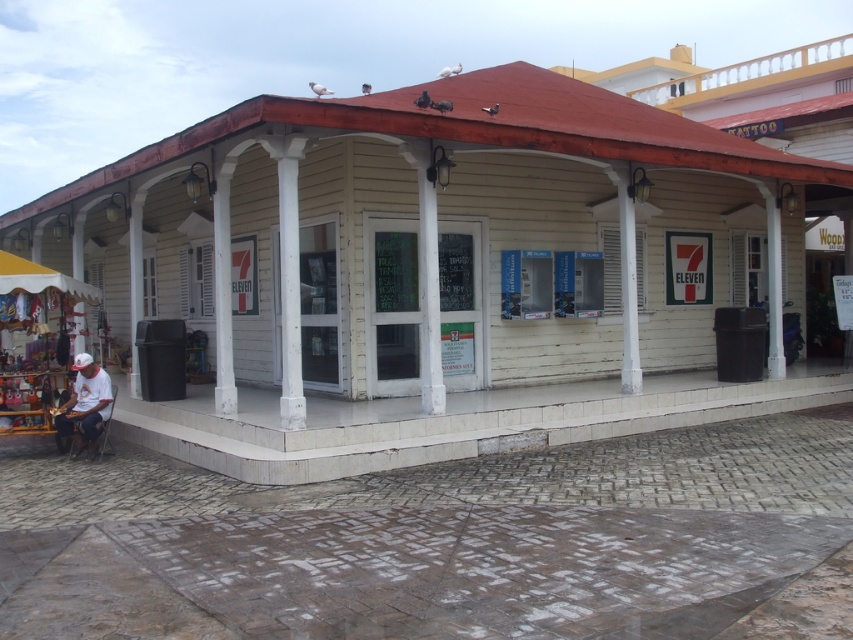
Question: Does white matte shirt at lower left come behind yellow fabric canopy at lower left?

Choices:
 (A) no
 (B) yes

Answer: (A)

Question: Which point is farther to the camera?

Choices:
 (A) (730, 177)
 (B) (93, 408)

Answer: (A)

Question: Does white wood 7-eleven at center appear on the left side of yellow fabric canopy at lower left?

Choices:
 (A) no
 (B) yes

Answer: (A)

Question: Which object is farther from the camera taking this photo?

Choices:
 (A) white matte shirt at lower left
 (B) white wood 7-eleven at center

Answer: (A)

Question: Is white wood 7-eleven at center bigger than white matte shirt at lower left?

Choices:
 (A) no
 (B) yes

Answer: (B)

Question: Which point is closer to the camera?

Choices:
 (A) (77, 436)
 (B) (686, 372)

Answer: (A)